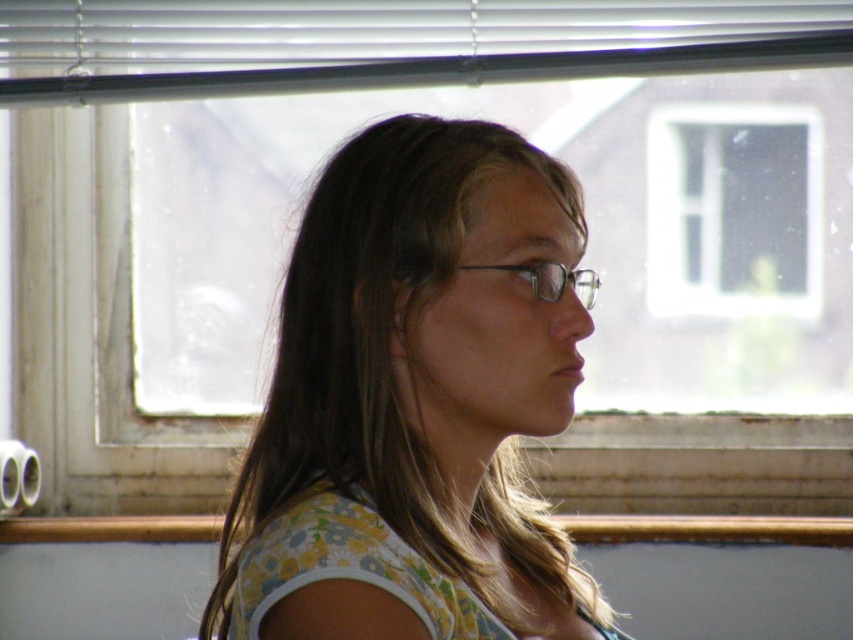
You are a window cleaner who needs to clean the white plastic blinds at upper center and the clear plastic glasses at center. Which object is closer to the left side of the window?

→ The white plastic blinds at upper center is to the left of clear plastic glasses at center, so the white plastic blinds at upper center is closer to the left side of the window.

From the picture: You are standing in the room and want to adjust the white plastic blinds at upper center. Considering your height is 1.70 meters, can you reach them without any assistance?

The white plastic blinds at upper center are 1.90 meters away from the viewer. Since your height is 1.70 meters, you may not be able to reach them comfortably without assistance.